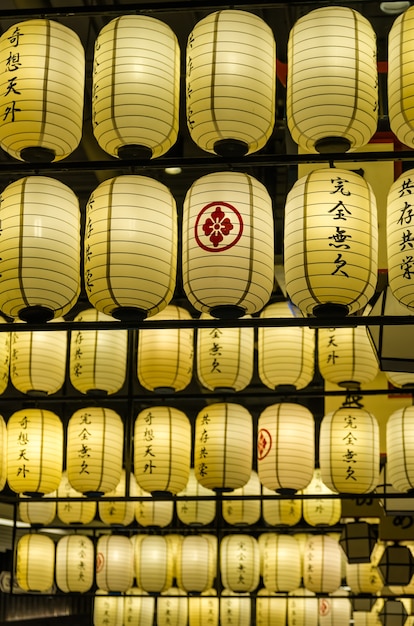
Where is `blurry rectangular objects that look like books`? The width and height of the screenshot is (414, 626). blurry rectangular objects that look like books is located at coordinates (26, 608).